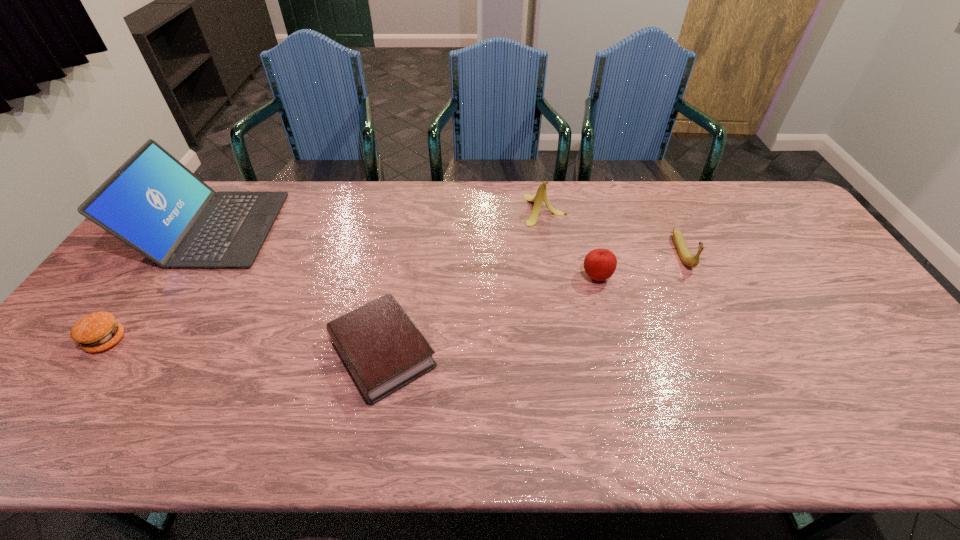
You are a GUI agent. You are given a task and a screenshot of the screen. Output one action in this format:
    pyautogui.click(x=<x>, y=<y>)
    Task: Click on the free area in between the laptop computer and the patty
    Image resolution: width=960 pixels, height=540 pixels.
    Given the screenshot: What is the action you would take?
    pyautogui.click(x=160, y=285)

This screenshot has width=960, height=540. In order to click on free area in between the shorter banana and the taller banana in this screenshot , I will do `click(613, 231)`.

Where is `free spot between the second object from right to left and the patty`? free spot between the second object from right to left and the patty is located at coordinates (351, 309).

Find the location of a particular element. The image size is (960, 540). empty space between the right banana and the second object from right to left is located at coordinates (639, 265).

The width and height of the screenshot is (960, 540). I want to click on blank region between the second object from right to left and the laptop computer, so click(405, 253).

Where is `object that can be found as the fourth closest to the right banana`? Image resolution: width=960 pixels, height=540 pixels. object that can be found as the fourth closest to the right banana is located at coordinates (x=153, y=203).

Point out which object is positioned as the second nearest to the patty. Please provide its 2D coordinates. Your answer should be formatted as a tuple, i.e. [(x, y)], where the tuple contains the x and y coordinates of a point satisfying the conditions above.

[(384, 350)]

Locate an element on the screen. Image resolution: width=960 pixels, height=540 pixels. vacant space that satisfies the following two spatial constraints: 1. on the back side of the patty; 2. on the left side of the third shortest object is located at coordinates (153, 277).

Identify the location of blank area in the image that satisfies the following two spatial constraints: 1. on the screen of the Bible; 2. on the left side of the laptop computer. The width and height of the screenshot is (960, 540). tap(133, 353).

The height and width of the screenshot is (540, 960). In order to click on vacant space that satisfies the following two spatial constraints: 1. on the screen of the laptop computer; 2. on the front side of the patty in this screenshot , I will do `click(141, 341)`.